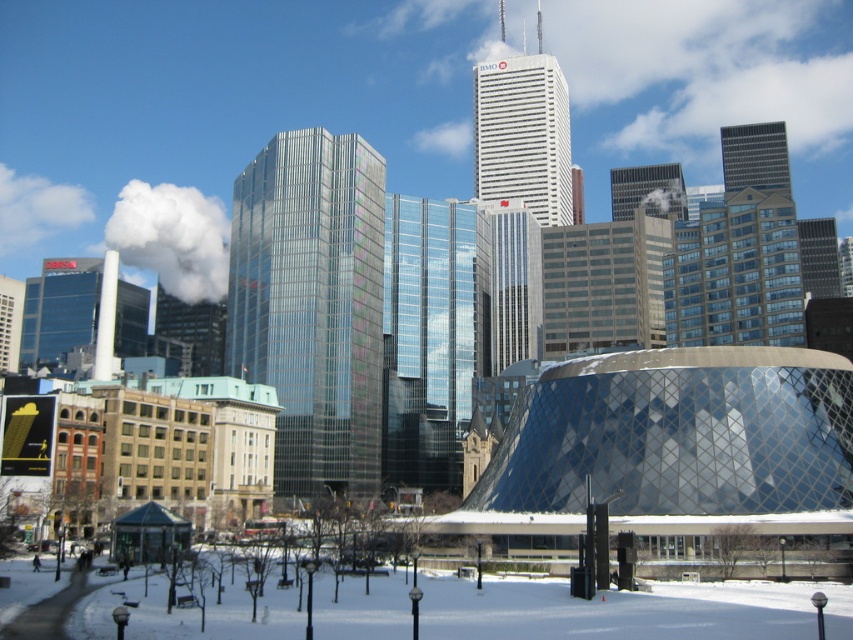
Measure the distance between point (543, 134) and camera.

A distance of 189.17 meters exists between point (543, 134) and camera.

Can you confirm if white glass skyscraper at center is positioned to the left of glassy reflective skyscraper at upper right?

Correct, you'll find white glass skyscraper at center to the left of glassy reflective skyscraper at upper right.

At what (x,y) coordinates should I click in order to perform the action: click on white glass skyscraper at center. Please return your answer as a coordinate pair (x, y). Looking at the image, I should click on pos(523,134).

Locate an element on the screen. Image resolution: width=853 pixels, height=640 pixels. white glass skyscraper at center is located at coordinates (523, 134).

Does shiny glass skyscraper at center have a greater height compared to glassy reflective skyscraper at upper right?

Yes, shiny glass skyscraper at center is taller than glassy reflective skyscraper at upper right.

Can you confirm if shiny glass skyscraper at center is smaller than glassy reflective skyscraper at upper right?

Incorrect, shiny glass skyscraper at center is not smaller in size than glassy reflective skyscraper at upper right.

Describe the element at coordinates (312, 305) in the screenshot. I see `shiny glass skyscraper at center` at that location.

Find the location of a particular element. This screenshot has width=853, height=640. shiny glass skyscraper at center is located at coordinates (312, 305).

Can you confirm if shiny glass skyscraper at center is taller than white glass skyscraper at center?

Yes, shiny glass skyscraper at center is taller than white glass skyscraper at center.

Describe the element at coordinates (312, 305) in the screenshot. I see `shiny glass skyscraper at center` at that location.

Locate an element on the screen. shiny glass skyscraper at center is located at coordinates (312, 305).